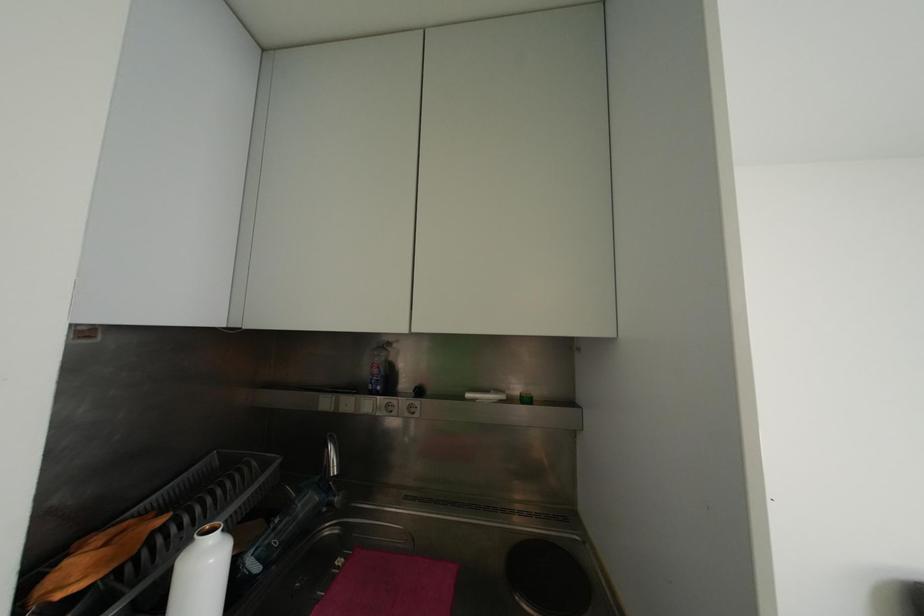
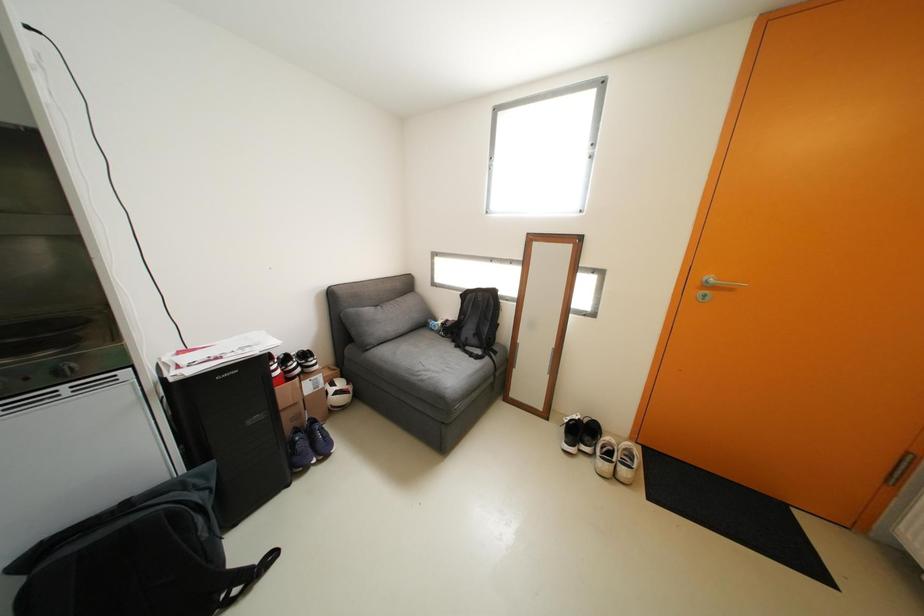
Based on the continuous images, in which direction is the camera rotating?

The camera's rotation is toward right-down.